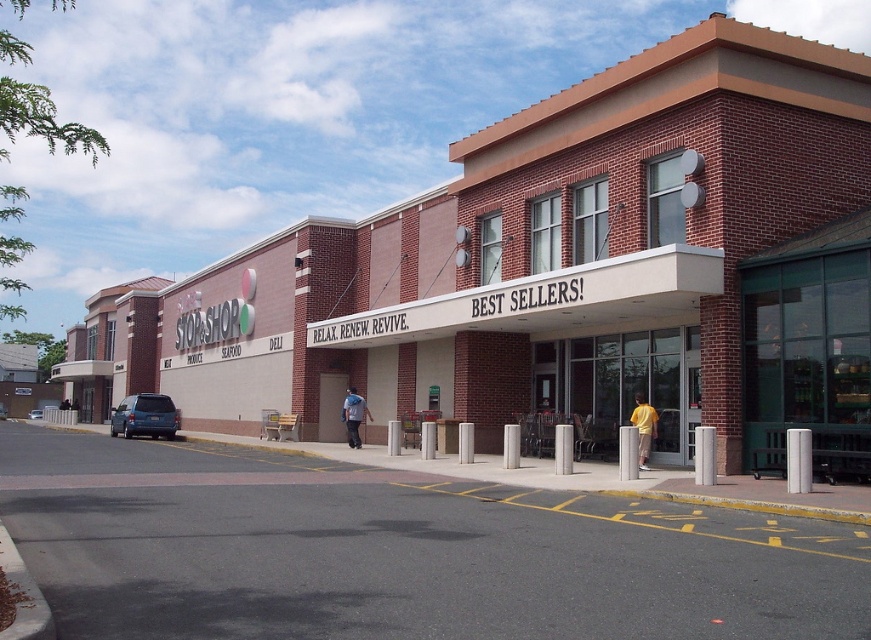
Question: Is matte blue suv at left further to camera compared to blue denim jacket at center?

Choices:
 (A) no
 (B) yes

Answer: (B)

Question: Does matte blue suv at left appear under blue denim jacket at center?

Choices:
 (A) yes
 (B) no

Answer: (A)

Question: Which object is closer to the camera taking this photo?

Choices:
 (A) matte blue suv at left
 (B) blue denim jacket at center

Answer: (B)

Question: Is yellow cotton shirt at center to the right of blue denim jacket at center from the viewer's perspective?

Choices:
 (A) no
 (B) yes

Answer: (B)

Question: Which point is farther from the camera taking this photo?

Choices:
 (A) (349, 419)
 (B) (636, 412)

Answer: (A)

Question: Which of the following is the closest to the observer?

Choices:
 (A) (646, 429)
 (B) (127, 396)
 (C) (363, 403)

Answer: (A)